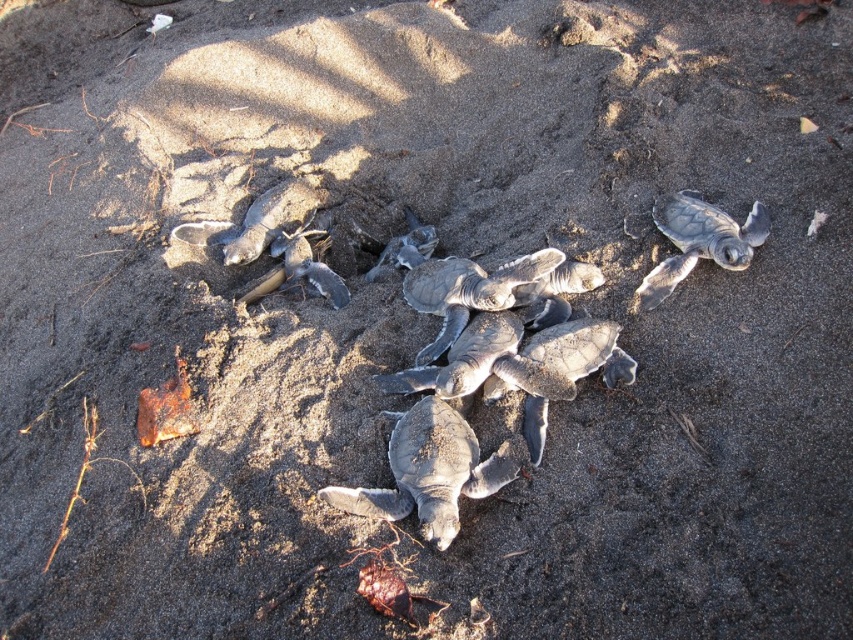
Question: Can you confirm if gray matte turtles at center is positioned to the left of gray matte turtle at center?

Choices:
 (A) yes
 (B) no

Answer: (B)

Question: Which of the following is the farthest from the observer?

Choices:
 (A) gray matte turtle at upper right
 (B) gray matte turtle at center
 (C) gray matte turtles at center

Answer: (A)

Question: Does gray matte turtles at center have a greater width compared to gray matte turtle at center?

Choices:
 (A) no
 (B) yes

Answer: (B)

Question: Is gray matte turtles at center thinner than gray matte turtle at center?

Choices:
 (A) yes
 (B) no

Answer: (B)

Question: Among these points, which one is farthest from the camera?

Choices:
 (A) (457, 504)
 (B) (724, 259)
 (C) (445, 321)

Answer: (B)

Question: Which point is closer to the camera taking this photo?

Choices:
 (A) (274, 243)
 (B) (357, 499)
 (C) (683, 200)

Answer: (B)